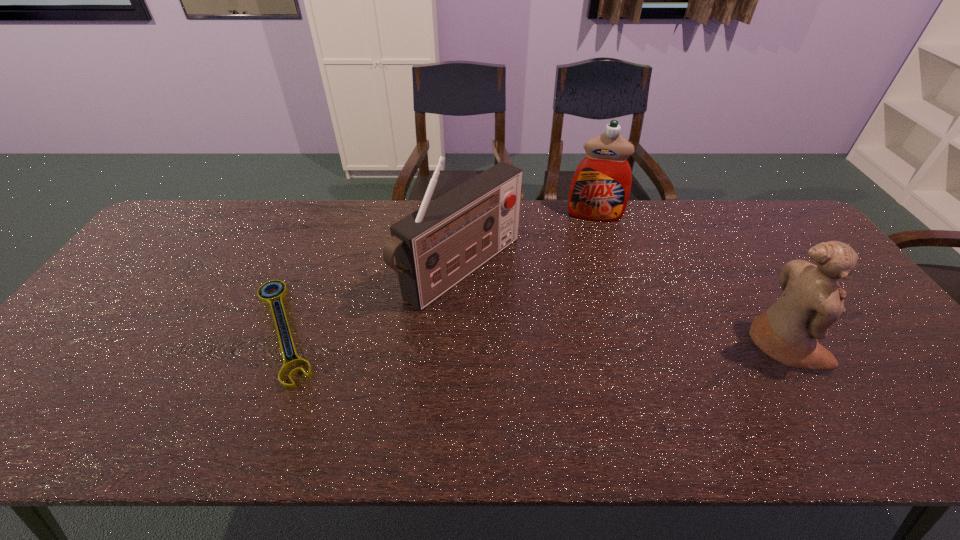
Where is `free space located on the front surface of the farthest object`? This screenshot has width=960, height=540. free space located on the front surface of the farthest object is located at coordinates (588, 296).

At what (x,y) coordinates should I click in order to perform the action: click on vacant space located 0.370m on the front panel of the second object from left to right. Please return your answer as a coordinate pair (x, y). Looking at the image, I should click on (629, 379).

Locate an element on the screen. This screenshot has width=960, height=540. blank space located 0.130m on the front panel of the second object from left to right is located at coordinates (545, 325).

At what (x,y) coordinates should I click in order to perform the action: click on vacant position located on the front panel of the second object from left to right. Please return your answer as a coordinate pair (x, y). Image resolution: width=960 pixels, height=540 pixels. Looking at the image, I should click on (613, 369).

Image resolution: width=960 pixels, height=540 pixels. In order to click on detergent at the far edge in this screenshot , I will do `click(600, 188)`.

Find the location of `radio receiver present at the far edge`. radio receiver present at the far edge is located at coordinates (435, 247).

This screenshot has height=540, width=960. I want to click on wrench at the near edge, so click(274, 298).

The width and height of the screenshot is (960, 540). Identify the location of figurine that is at the near edge. (812, 300).

In the image, there is a desktop. Where is `vacant area at the far edge`? The height and width of the screenshot is (540, 960). vacant area at the far edge is located at coordinates (525, 214).

In order to click on free spot at the near edge of the desktop in this screenshot , I will do `click(838, 373)`.